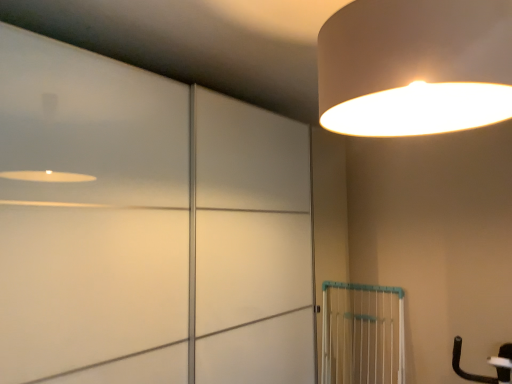
Where is `white matte sliding door at upper left`? The width and height of the screenshot is (512, 384). white matte sliding door at upper left is located at coordinates (88, 208).

You are a GUI agent. You are given a task and a screenshot of the screen. Output one action in this format:
    pyautogui.click(x=<x>, y=<y>)
    Task: Click on the white plastic gate at lower right
    Image resolution: width=512 pixels, height=384 pixels.
    Given the screenshot: What is the action you would take?
    pyautogui.click(x=362, y=334)

Locate an element on the screen. white matte sliding door at upper left is located at coordinates (88, 208).

Is matte white lampshade at upper right further to the viewer compared to white plastic gate at lower right?

No, matte white lampshade at upper right is closer to the camera.

Looking at this image, is matte white lampshade at upper right next to white plastic gate at lower right?

matte white lampshade at upper right and white plastic gate at lower right are not in contact.

Can you confirm if matte white lampshade at upper right is wider than white plastic gate at lower right?

Yes, matte white lampshade at upper right is wider than white plastic gate at lower right.

From a real-world perspective, who is located higher, matte white lampshade at upper right or white plastic gate at lower right?

matte white lampshade at upper right, from a real-world perspective.

Is point (79, 199) farther from viewer compared to point (460, 48)?

Yes, it is behind point (460, 48).

Can we say white matte sliding door at upper left lies outside matte white lampshade at upper right?

Yes.

In order to click on lamp that appears in front of the white matte sliding door at upper left in this screenshot , I will do `click(415, 67)`.

Can you confirm if white matte sliding door at upper left is bigger than matte white lampshade at upper right?

Yes, white matte sliding door at upper left is bigger than matte white lampshade at upper right.

Based on the photo, from the image's perspective, is white plastic gate at lower right beneath white matte sliding door at upper left?

Yes.

Which of these two, white plastic gate at lower right or white matte sliding door at upper left, is thinner?

Thinner between the two is white plastic gate at lower right.

Between white plastic gate at lower right and white matte sliding door at upper left, which one has smaller size?

white plastic gate at lower right is smaller.

Choose the correct answer: Is white matte sliding door at upper left inside white plastic gate at lower right or outside it?

The correct answer is: outside.

Who is smaller, white matte sliding door at upper left or white plastic gate at lower right?

Smaller between the two is white plastic gate at lower right.

Is white matte sliding door at upper left looking in the opposite direction of white plastic gate at lower right?

No, white matte sliding door at upper left's orientation is not away from white plastic gate at lower right.

In terms of height, does white matte sliding door at upper left look taller or shorter compared to white plastic gate at lower right?

white matte sliding door at upper left is taller than white plastic gate at lower right.

Is point (327, 354) farther from camera compared to point (502, 104)?

That is True.

Is white plastic gate at lower right thinner than matte white lampshade at upper right?

Indeed, white plastic gate at lower right has a lesser width compared to matte white lampshade at upper right.

Where is `lamp that appears in front of the white plastic gate at lower right`? This screenshot has width=512, height=384. lamp that appears in front of the white plastic gate at lower right is located at coordinates (415, 67).

From the image's perspective, which object appears higher, white plastic gate at lower right or matte white lampshade at upper right?

matte white lampshade at upper right, from the image's perspective.

From the image's perspective, which object appears higher, matte white lampshade at upper right or white matte sliding door at upper left?

matte white lampshade at upper right, from the image's perspective.

Is point (323, 57) in front of point (35, 55)?

Yes, point (323, 57) is closer to viewer.

You are a GUI agent. You are given a task and a screenshot of the screen. Output one action in this format:
    pyautogui.click(x=<x>, y=<y>)
    Task: Click on the lamp above the white plastic gate at lower right (from a real-world perspective)
    The height and width of the screenshot is (384, 512).
    Given the screenshot: What is the action you would take?
    pyautogui.click(x=415, y=67)

The height and width of the screenshot is (384, 512). In order to click on lamp above the white matte sliding door at upper left (from the image's perspective) in this screenshot , I will do (415, 67).

From the picture: Based on their spatial positions, is matte white lampshade at upper right or white plastic gate at lower right closer to white matte sliding door at upper left?

matte white lampshade at upper right is closer to white matte sliding door at upper left.

Which object lies nearer to the anchor point white matte sliding door at upper left, white plastic gate at lower right or matte white lampshade at upper right?

matte white lampshade at upper right is positioned closer to the anchor white matte sliding door at upper left.

When comparing their distances from white plastic gate at lower right, does matte white lampshade at upper right or white matte sliding door at upper left seem further?

Among the two, matte white lampshade at upper right is located further to white plastic gate at lower right.

Looking at the image, which one is located further to white plastic gate at lower right, white matte sliding door at upper left or matte white lampshade at upper right?

The object further to white plastic gate at lower right is matte white lampshade at upper right.

Estimate the real-world distances between objects in this image. Which object is further from matte white lampshade at upper right, white matte sliding door at upper left or white plastic gate at lower right?

Among the two, white plastic gate at lower right is located further to matte white lampshade at upper right.

Considering their positions, is white plastic gate at lower right positioned further to matte white lampshade at upper right than white matte sliding door at upper left?

white plastic gate at lower right lies further to matte white lampshade at upper right than the other object.

Image resolution: width=512 pixels, height=384 pixels. What are the coordinates of `door between matte white lampshade at upper right and white plastic gate at lower right from front to back` in the screenshot? It's located at (88, 208).